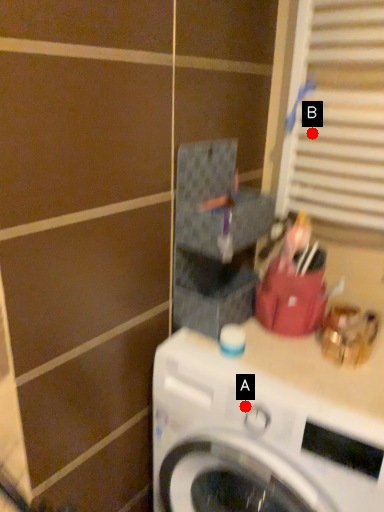
Question: Two points are circled on the image, labeled by A and B beside each circle. Which point appears farthest from the camera in this image?

Choices:
 (A) A is further
 (B) B is further

Answer: (B)